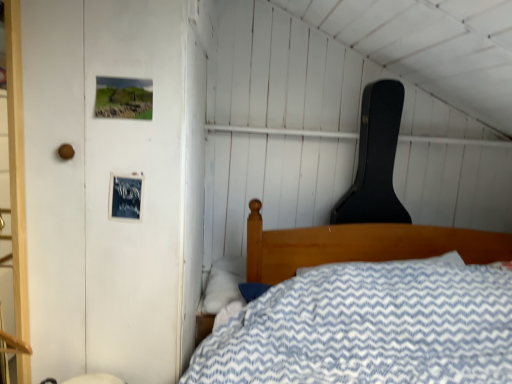
This screenshot has width=512, height=384. Find the location of `white soft pillow at lower left`. white soft pillow at lower left is located at coordinates (224, 283).

What is the approximate width of white soft pillow at lower left?

white soft pillow at lower left is 11.11 inches wide.

Describe the element at coordinates (224, 283) in the screenshot. This screenshot has width=512, height=384. I see `white soft pillow at lower left` at that location.

I want to click on white soft pillow at lower left, so click(x=224, y=283).